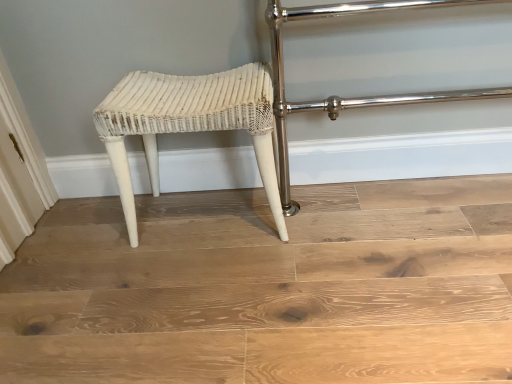
Question: Is white wicker stool at center taller or shorter than white wicker stool at center?

Choices:
 (A) short
 (B) tall

Answer: (B)

Question: Choose the correct answer: Is white wicker stool at center inside white wicker stool at center or outside it?

Choices:
 (A) outside
 (B) inside

Answer: (A)

Question: Does point (195, 115) appear closer or farther from the camera than point (2, 362)?

Choices:
 (A) farther
 (B) closer

Answer: (A)

Question: Is white wicker stool at center spatially inside white wicker stool at center, or outside of it?

Choices:
 (A) outside
 (B) inside

Answer: (A)

Question: Considering the positions of point (483, 276) and point (217, 74), is point (483, 276) closer or farther from the camera than point (217, 74)?

Choices:
 (A) closer
 (B) farther

Answer: (A)

Question: From the image's perspective, is white wicker stool at center located above or below white wicker stool at center?

Choices:
 (A) above
 (B) below

Answer: (B)

Question: From their relative heights in the image, would you say white wicker stool at center is taller or shorter than white wicker stool at center?

Choices:
 (A) tall
 (B) short

Answer: (B)